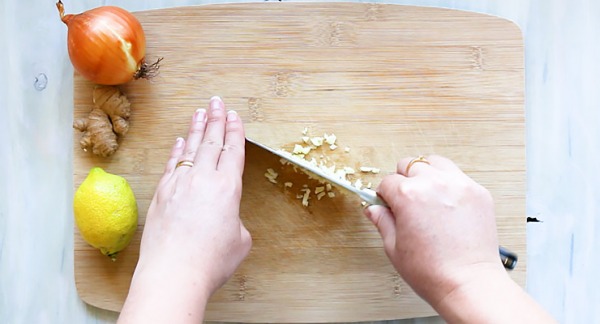
This screenshot has width=600, height=324. Identify the location of small dark object on side of cutting board. (534, 220).